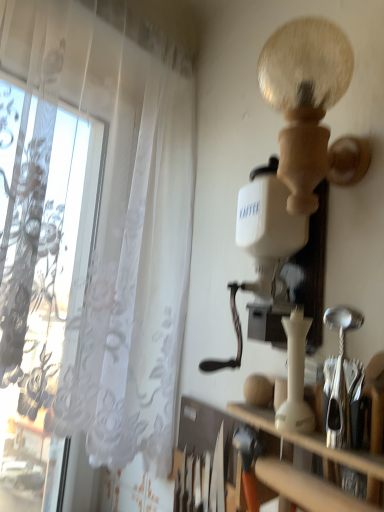
Question: Considering the positions of point (301, 494) and point (112, 290), is point (301, 494) closer or farther from the camera than point (112, 290)?

Choices:
 (A) closer
 (B) farther

Answer: (A)

Question: Considering the positions of wooden at right and white sheer curtain at left in the image, is wooden at right taller or shorter than white sheer curtain at left?

Choices:
 (A) tall
 (B) short

Answer: (B)

Question: From the image's perspective, is wooden at right positioned above or below white sheer curtain at left?

Choices:
 (A) below
 (B) above

Answer: (A)

Question: Is white sheer curtain at left in front of or behind wooden at right in the image?

Choices:
 (A) front
 (B) behind

Answer: (B)

Question: From the image's perspective, is white sheer curtain at left located above or below wooden at right?

Choices:
 (A) below
 (B) above

Answer: (B)

Question: Does point (18, 459) appear closer or farther from the camera than point (337, 452)?

Choices:
 (A) closer
 (B) farther

Answer: (B)

Question: In terms of height, does white sheer curtain at left look taller or shorter compared to wooden at right?

Choices:
 (A) tall
 (B) short

Answer: (A)